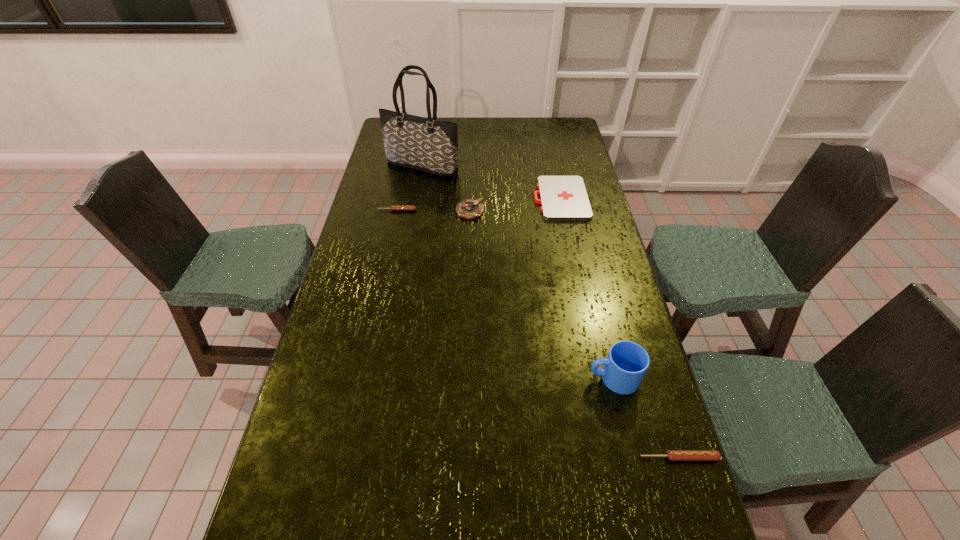
Image resolution: width=960 pixels, height=540 pixels. I want to click on vacant position for inserting another sausage evenly, so click(x=504, y=304).